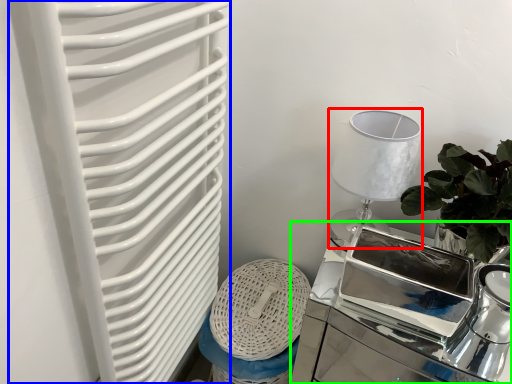
Question: Which object is the closest to the table lamp (highlighted by a red box)? Choose among these: radiator (highlighted by a blue box) or table (highlighted by a green box).

Choices:
 (A) radiator
 (B) table

Answer: (B)